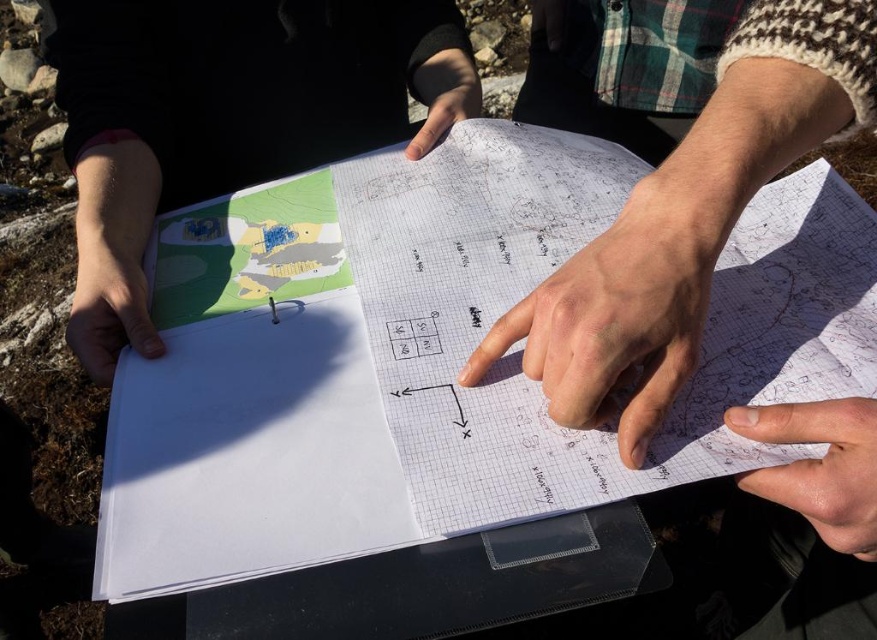
Question: Where is matte paper map at upper left located in relation to smooth skin hand at lower right in the image?

Choices:
 (A) left
 (B) right

Answer: (A)

Question: Among these objects, which one is nearest to the camera?

Choices:
 (A) smooth skin hand at lower right
 (B) smooth paper hand at center
 (C) matte white paper at lower left

Answer: (A)

Question: Does matte paper map at upper left appear over smooth paper hand at center?

Choices:
 (A) no
 (B) yes

Answer: (B)

Question: Among these objects, which one is farthest from the camera?

Choices:
 (A) matte paper map at upper left
 (B) smooth paper hand at center
 (C) smooth skin hand at lower right
 (D) matte white paper at lower left

Answer: (A)

Question: Which point appears closest to the camera in this image?

Choices:
 (A) (191, 157)
 (B) (766, 420)

Answer: (B)

Question: Is smooth paper hand at center behind matte white paper at lower left?

Choices:
 (A) yes
 (B) no

Answer: (B)